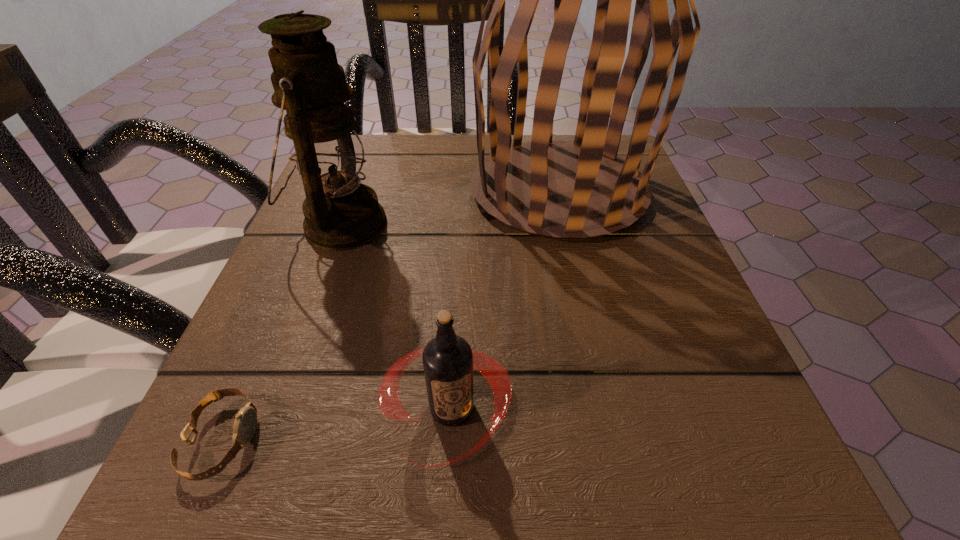
At what (x,y) coordinates should I click in order to perform the action: click on vacant space in between the birdcage and the root beer. Please return your answer as a coordinate pair (x, y). Looking at the image, I should click on (505, 300).

Locate an element on the screen. free space between the tallest object and the oil lamp is located at coordinates (449, 207).

Find the location of a particular element. free spot between the tallest object and the second tallest object is located at coordinates (449, 207).

Choose which object is the third nearest neighbor to the shortest object. Please provide its 2D coordinates. Your answer should be formatted as a tuple, i.e. [(x, y)], where the tuple contains the x and y coordinates of a point satisfying the conditions above.

[(561, 190)]

Choose which object is the second nearest neighbor to the third shortest object. Please provide its 2D coordinates. Your answer should be formatted as a tuple, i.e. [(x, y)], where the tuple contains the x and y coordinates of a point satisfying the conditions above.

[(448, 360)]

Find the location of a particular element. vacant position in the image that satisfies the following two spatial constraints: 1. on the label of the second shortest object; 2. on the face of the watch is located at coordinates (450, 440).

Where is `blank space that satisfies the following two spatial constraints: 1. on the front side of the second tallest object; 2. on the face of the watch`? The width and height of the screenshot is (960, 540). blank space that satisfies the following two spatial constraints: 1. on the front side of the second tallest object; 2. on the face of the watch is located at coordinates (261, 440).

This screenshot has width=960, height=540. What are the coordinates of `free space in the image that satisfies the following two spatial constraints: 1. on the label of the root beer; 2. on the face of the shortest object` in the screenshot? It's located at (450, 440).